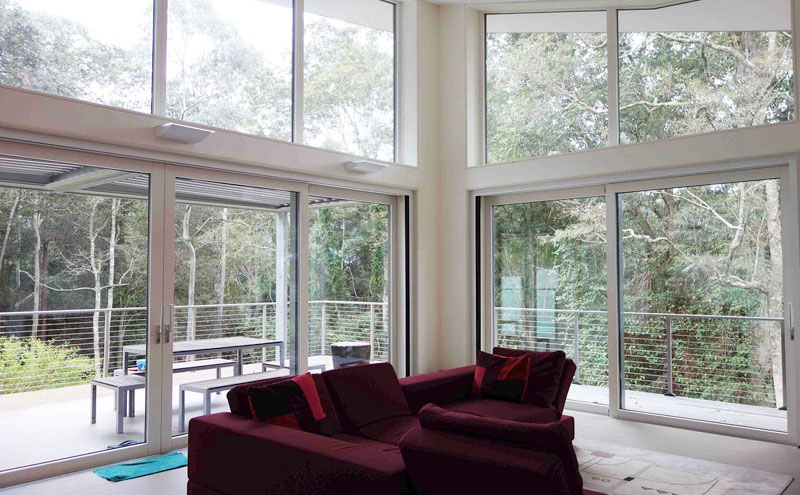
Where is `cushion`? Image resolution: width=800 pixels, height=495 pixels. cushion is located at coordinates (498, 430), (497, 377), (540, 371), (509, 408), (364, 398), (300, 405), (396, 431).